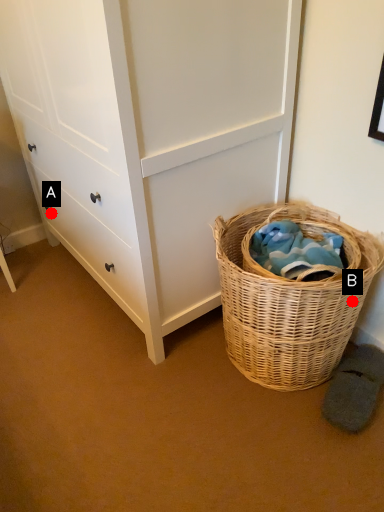
Question: Two points are circled on the image, labeled by A and B beside each circle. Among these points, which one is nearest to the camera?

Choices:
 (A) A is closer
 (B) B is closer

Answer: (B)